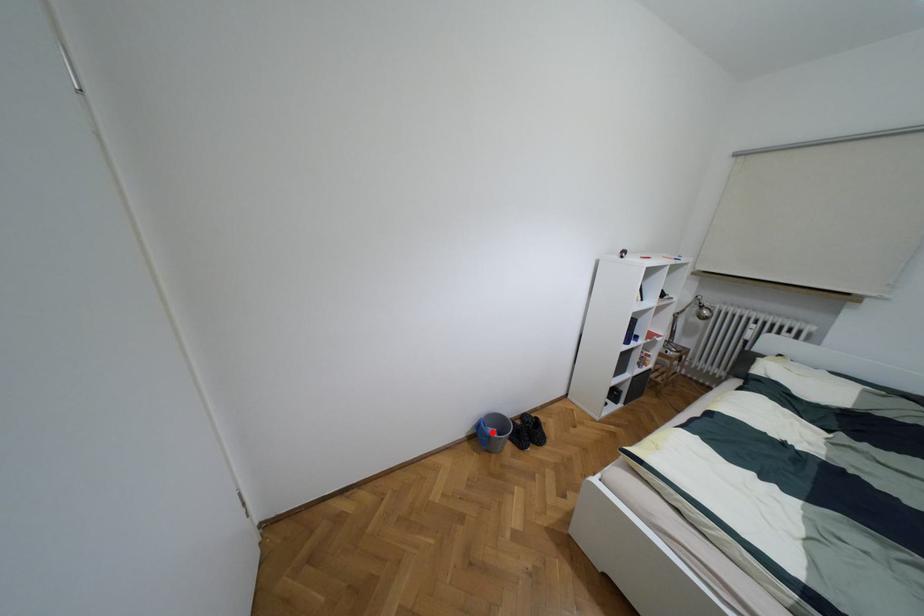
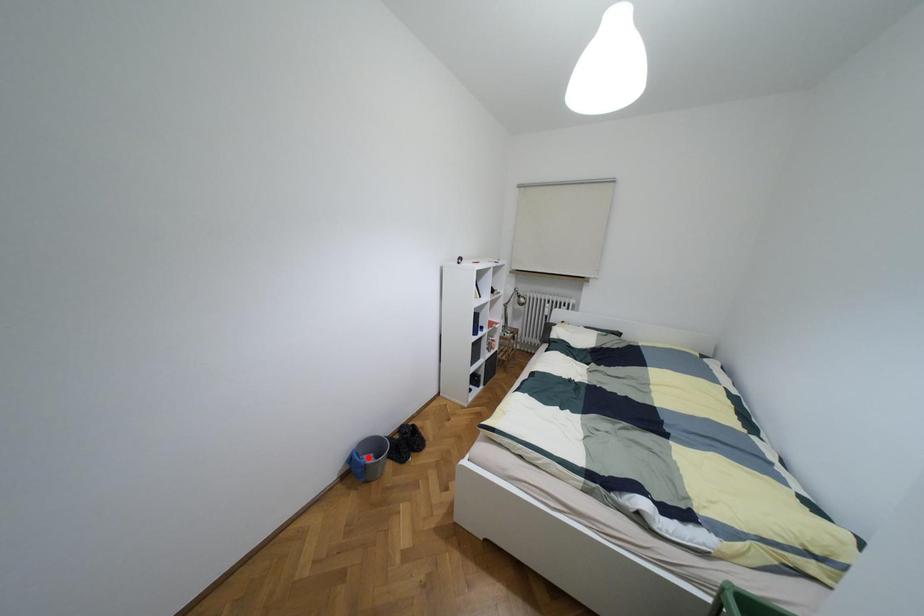
I am providing you with two images of the same scene from different viewpoints. A red point is marked on the first image and another point is marked on the second image. Is the red point in image1 aligned with the point shown in image2?

No